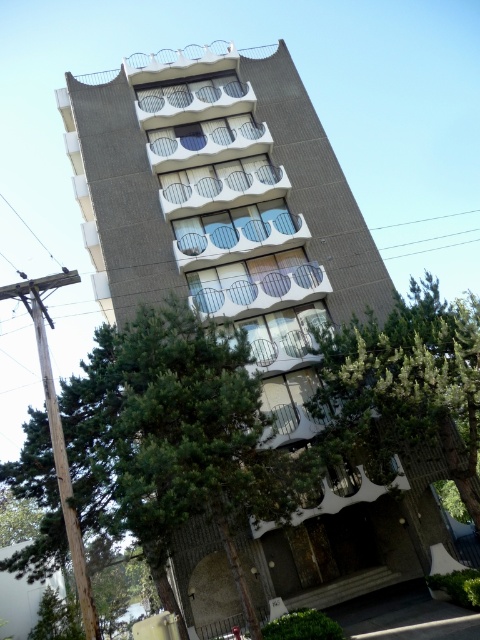
Question: Can you confirm if green leafy tree at center is smaller than green leafy tree at lower right?

Choices:
 (A) no
 (B) yes

Answer: (B)

Question: Does green leafy tree at center appear under green leafy tree at lower right?

Choices:
 (A) no
 (B) yes

Answer: (B)

Question: Is green leafy tree at center bigger than green leafy tree at lower right?

Choices:
 (A) no
 (B) yes

Answer: (A)

Question: Which point is farther to the camera?

Choices:
 (A) (227, 340)
 (B) (406, 358)

Answer: (B)

Question: Which point is farther from the camera taking this photo?

Choices:
 (A) (410, 403)
 (B) (115, 417)

Answer: (A)

Question: Which object is closer to the camera taking this photo?

Choices:
 (A) green leafy tree at lower right
 (B) green leafy tree at center

Answer: (B)